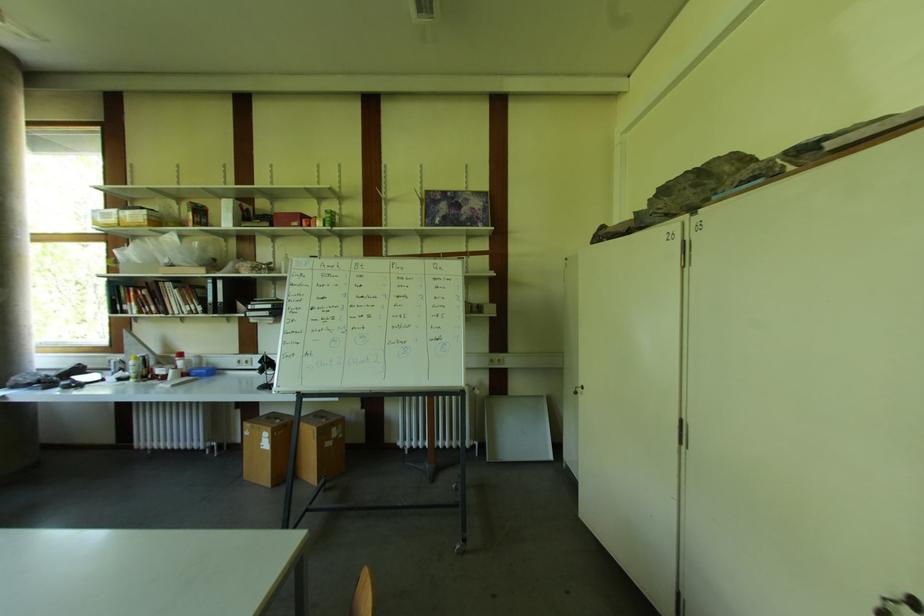
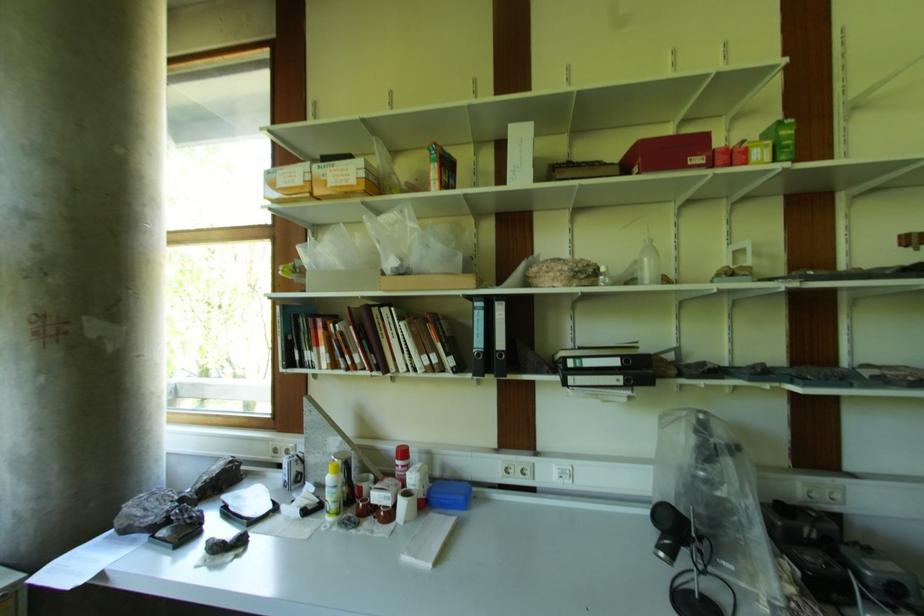
In a continuous first-person perspective shot, in which direction is the camera moving?

The movement direction of the cameraman is left, forward.